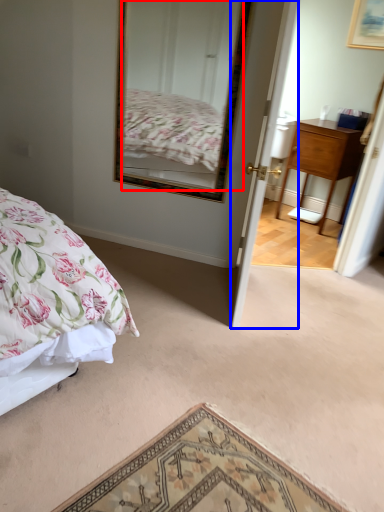
Question: Among these objects, which one is nearest to the camera, mirror (highlighted by a red box) or door (highlighted by a blue box)?

Choices:
 (A) mirror
 (B) door

Answer: (B)